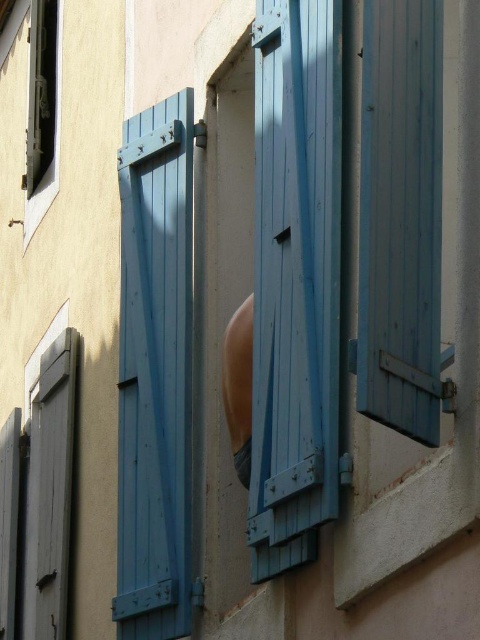
You are standing in front of the building and see the point marked at coordinates (43, 112). What is located at that point?

The point at coordinates (43, 112) marks the matte black window at upper left.

You are standing in front of a building with two windows that have blue wooden shutters. You notice two points marked on the wall, one at point coordinates (x=35, y=28) and the other at (x=249, y=467). Which point is closer to you?

Point (x=35, y=28) is further to the camera than point (x=249, y=467). Therefore, point (x=249, y=467) is closer to you.

Looking at this image, you are standing in front of a building with two windows. You see a matte black window at upper left and a smooth peach skin at center. Which object is positioned more to the left?

The matte black window at upper left is positioned more to the left than the smooth peach skin at center.